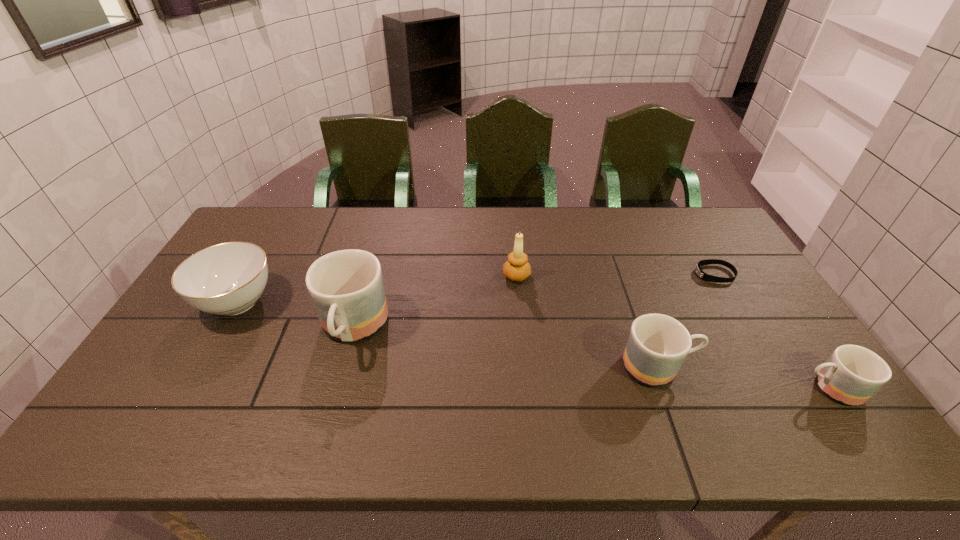
The width and height of the screenshot is (960, 540). Find the location of `the tallest mug`. the tallest mug is located at coordinates (346, 287).

Where is `the leftmost mug`? the leftmost mug is located at coordinates (346, 287).

The image size is (960, 540). Find the location of `the second mug from right to left`. the second mug from right to left is located at coordinates (657, 346).

This screenshot has width=960, height=540. Identify the location of the second shortest mug. (657, 346).

I want to click on the rightmost mug, so click(852, 374).

This screenshot has height=540, width=960. I want to click on the second shortest object, so click(x=852, y=374).

Image resolution: width=960 pixels, height=540 pixels. In order to click on the shortest object in this screenshot , I will do `click(706, 277)`.

Locate an element on the screen. chinaware is located at coordinates (225, 279).

This screenshot has height=540, width=960. I want to click on candle_holder, so click(x=517, y=268).

At what (x,y) coordinates should I click in order to perform the action: click on free point located 0.060m on the side with the handle of the second object from left to right. Please return your answer as a coordinate pair (x, y). This screenshot has width=960, height=540. Looking at the image, I should click on (337, 388).